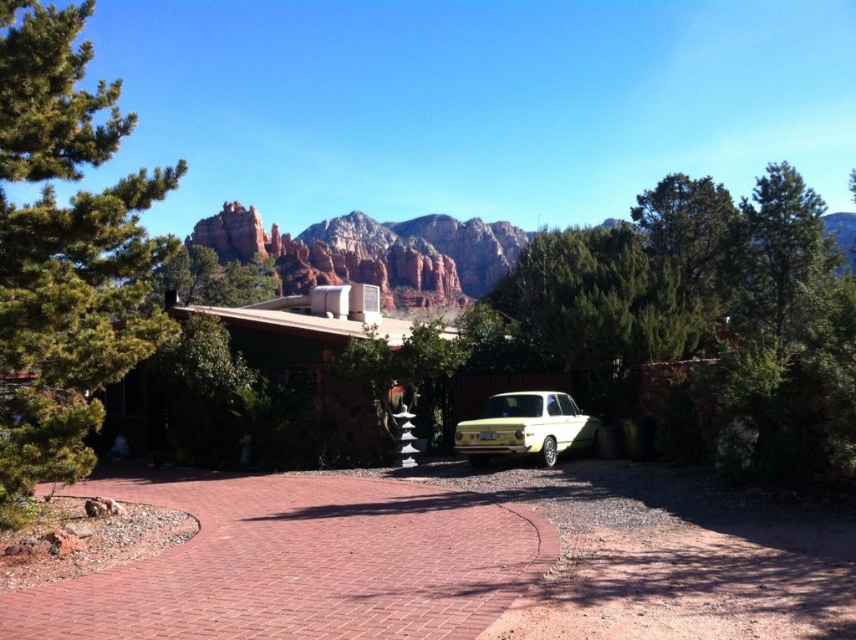
You are a delivery person needing to park your 5.5 meter long truck next to the yellow matte car at center. The green textured tree at upper right is in the way. Can you park your truck there without hitting the tree?

The green textured tree at upper right is 12.62 meters away from the yellow matte car at center. Since your truck is 5.5 meters long, there is enough space between them to park without hitting the tree.

You are a landscape architect designing a garden for the house. You need to decide where to place a new water feature. The water feature requires a space larger than the area occupied by the brick at center. Can the green pine tree at left provide enough space for this water feature?

The green pine tree at left occupies more space than the brick at center. Therefore, the area around the green pine tree at left likely has sufficient space to accommodate the water feature since it occupies a larger area than the brick at center.

You are a visitor arriving at this house and need to park your car, which is slightly larger than the yellow matte car at center. There is space available in the driveway. Considering the size of the green textured tree at upper right, will your car fit in the parking spot without hitting the tree?

The green textured tree at upper right is larger in size than the yellow matte car at center. Since your car is only slightly larger than the yellow matte car at center, it should still fit in the parking spot without hitting the tree, as the tree is larger and likely provides enough clearance.